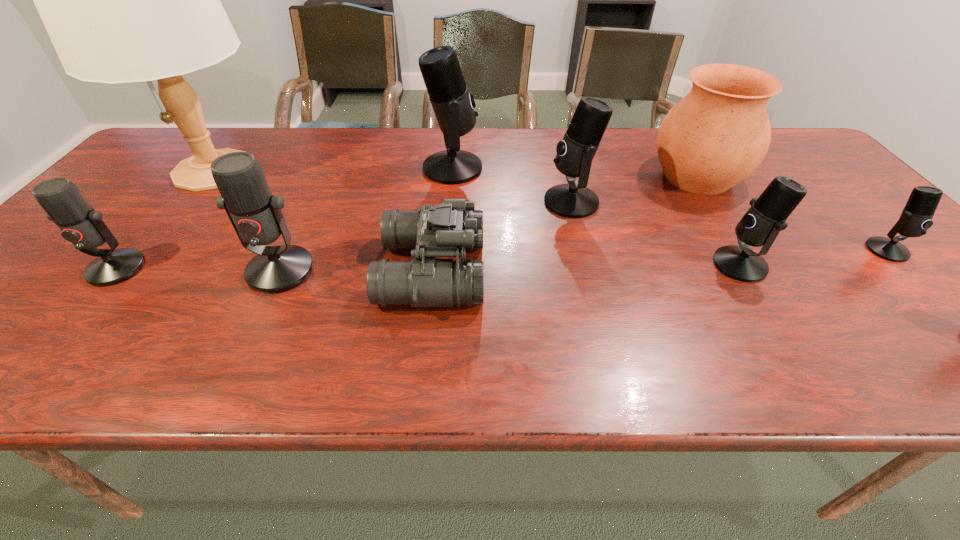
Locate which black microphone is the closest to the fourth microphone from left to right. Please provide its 2D coordinates. Your answer should be formatted as a tuple, i.e. [(x, y)], where the tuple contains the x and y coordinates of a point satisfying the conditions above.

[(453, 105)]

Find the location of `the third closest black microphone to the beige table lamp`. the third closest black microphone to the beige table lamp is located at coordinates (761, 224).

Locate an element on the screen. free point that satisfies the following two spatial constraints: 1. on the stand of the third black microphone from right to left; 2. on the side of the bigger red microphone with the red ring is located at coordinates (588, 271).

You are a GUI agent. You are given a task and a screenshot of the screen. Output one action in this format:
    pyautogui.click(x=<x>, y=<y>)
    Task: Click on the vacant space that satisfies the following two spatial constraints: 1. on the stand of the shortest microphone; 2. through the lenses of the blue binoculars
    The width and height of the screenshot is (960, 540).
    Given the screenshot: What is the action you would take?
    pyautogui.click(x=908, y=271)